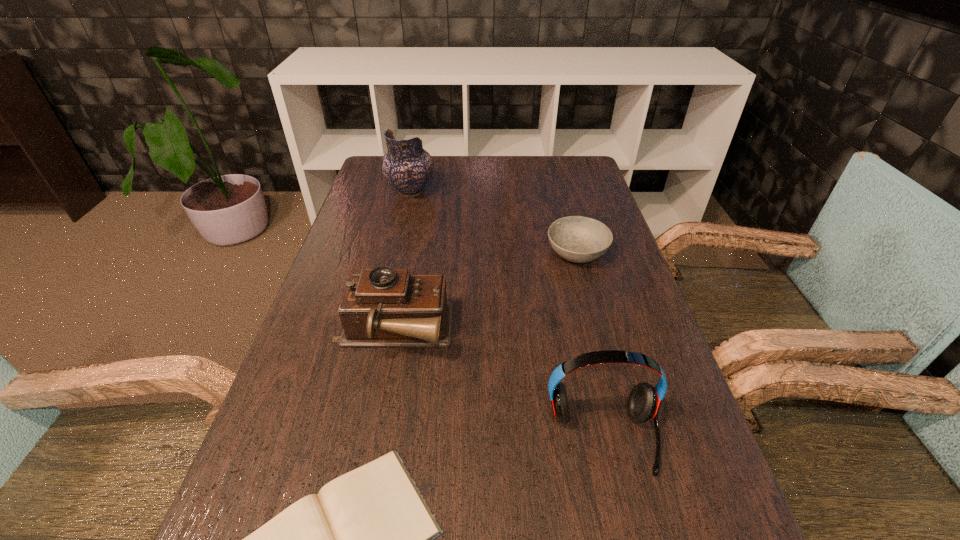
The width and height of the screenshot is (960, 540). I want to click on the farthest object, so click(x=406, y=166).

This screenshot has width=960, height=540. Find the location of `headset`. headset is located at coordinates (644, 400).

Identify the location of phonograph_record. (383, 307).

Locate an element on the screen. the third tallest object is located at coordinates (383, 307).

You are a GUI agent. You are given a task and a screenshot of the screen. Output one action in this format:
    pyautogui.click(x=<x>, y=<y>)
    Task: Click on the bowl
    
    Given the screenshot: What is the action you would take?
    pyautogui.click(x=578, y=239)

In order to click on the second farthest object in this screenshot , I will do `click(578, 239)`.

You are a GUI agent. You are given a task and a screenshot of the screen. Output one action in this format:
    pyautogui.click(x=<x>, y=<y>)
    Task: Click on the free space located on the front of the pottery
    This screenshot has width=960, height=540.
    Given the screenshot: What is the action you would take?
    pyautogui.click(x=398, y=243)

Identify the location of vacant region located with the microphone attached to the side of the headset. The height and width of the screenshot is (540, 960). (620, 517).

Where is `free spot located on the horn of the phonograph_record`? This screenshot has width=960, height=540. free spot located on the horn of the phonograph_record is located at coordinates (516, 333).

Where is `free space located on the back of the second shortest object`? The width and height of the screenshot is (960, 540). free space located on the back of the second shortest object is located at coordinates (564, 205).